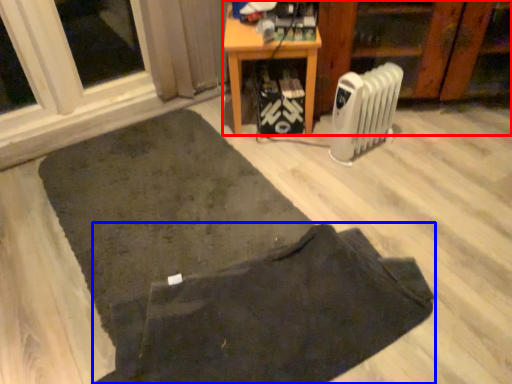
Question: Which of the following is the closest to the observer, furniture (highlighted by a red box) or doormat (highlighted by a blue box)?

Choices:
 (A) furniture
 (B) doormat

Answer: (B)